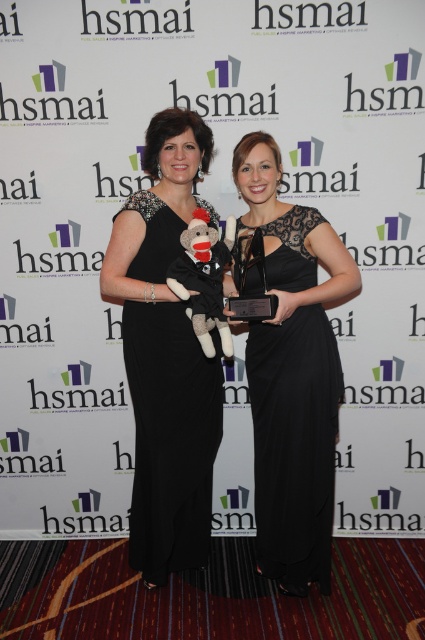
Question: Which object appears farthest from the camera in this image?

Choices:
 (A) black satin dress at left
 (B) black lace dress at center

Answer: (A)

Question: Does black lace dress at center appear on the left side of black satin dress at left?

Choices:
 (A) yes
 (B) no

Answer: (B)

Question: Does black lace dress at center appear on the left side of black satin dress at left?

Choices:
 (A) yes
 (B) no

Answer: (B)

Question: Which point is closer to the camera?

Choices:
 (A) black lace dress at center
 (B) black satin dress at left

Answer: (A)

Question: Does black lace dress at center lie behind black satin dress at left?

Choices:
 (A) no
 (B) yes

Answer: (A)